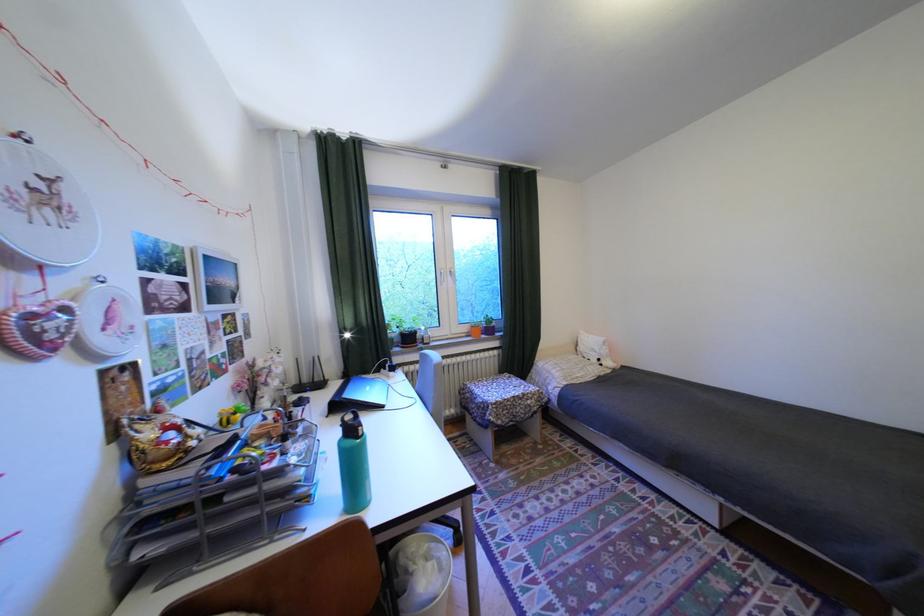
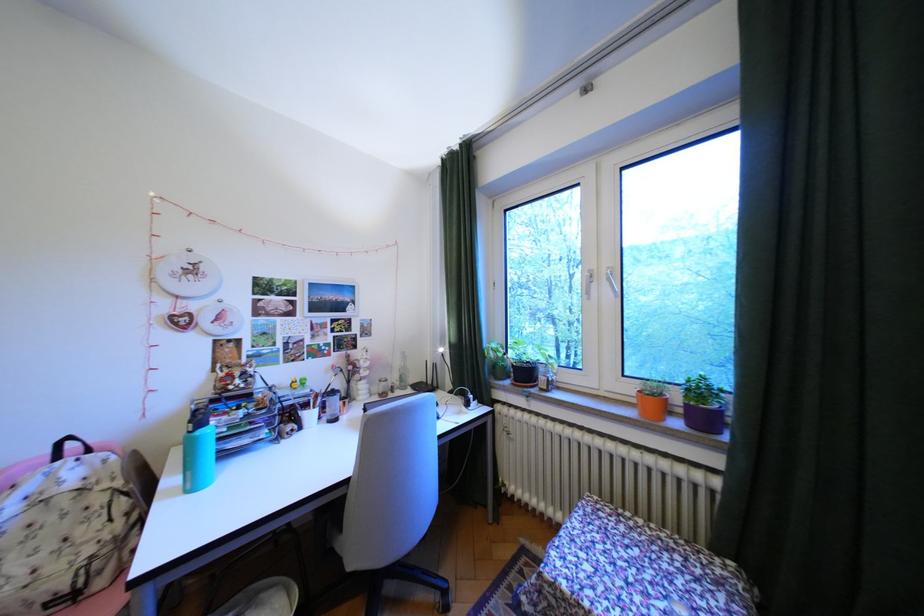
Find the pixel in the second image that matches the point at 478,329 in the first image.

(641, 390)